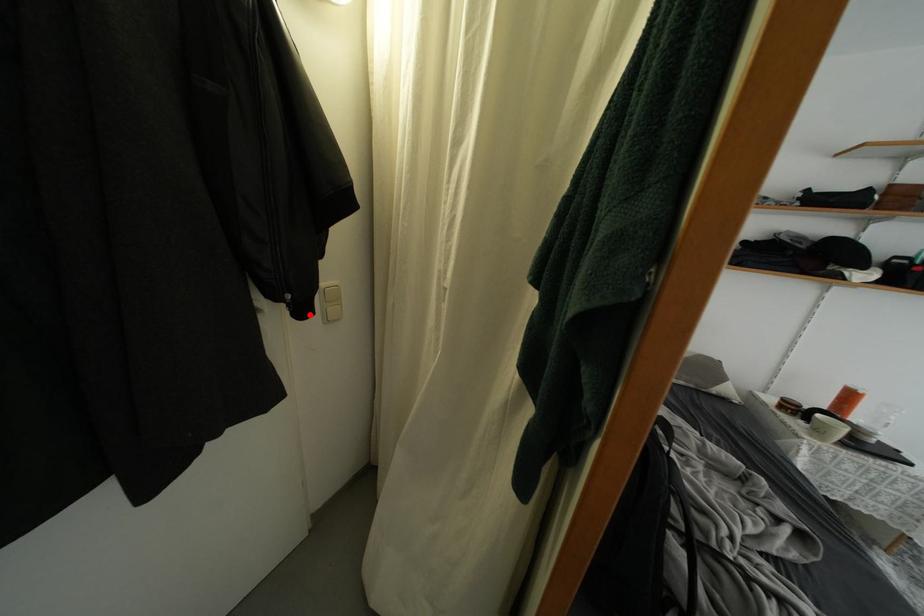
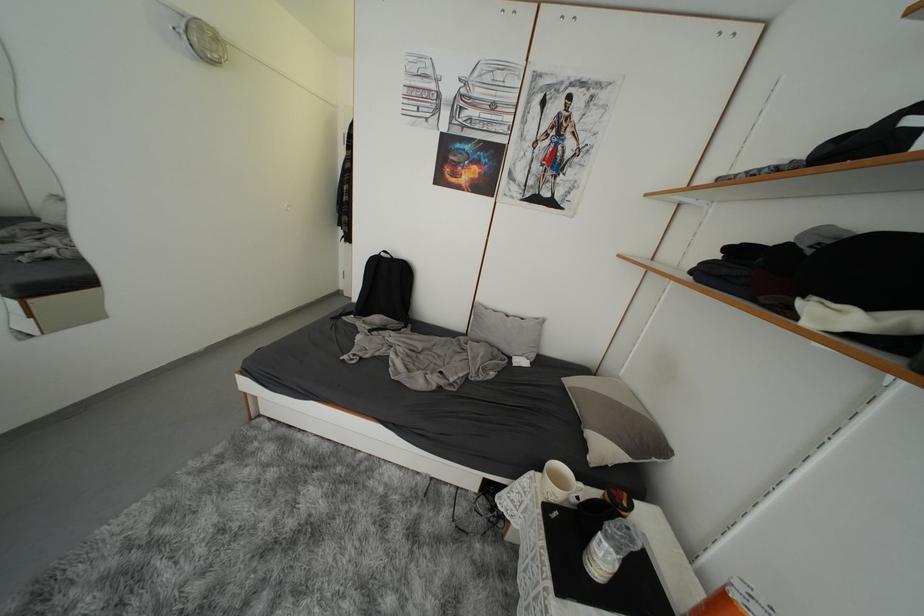
Question: I am providing you with two images of the same scene from different viewpoints. A red point is marked on the first image. At the location where the point appears in image 1, is it still visible in image 2?

Choices:
 (A) Yes
 (B) No

Answer: (B)